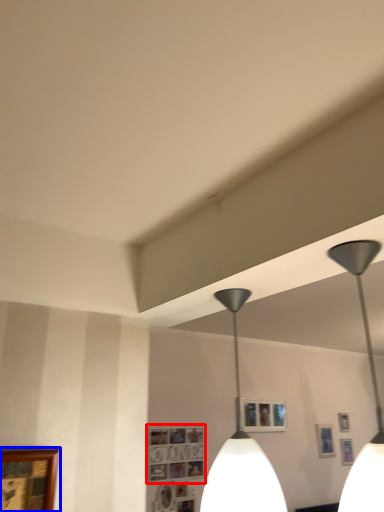
Question: Among these objects, which one is farthest to the camera, picture frame (highlighted by a red box) or picture frame (highlighted by a blue box)?

Choices:
 (A) picture frame
 (B) picture frame

Answer: (A)